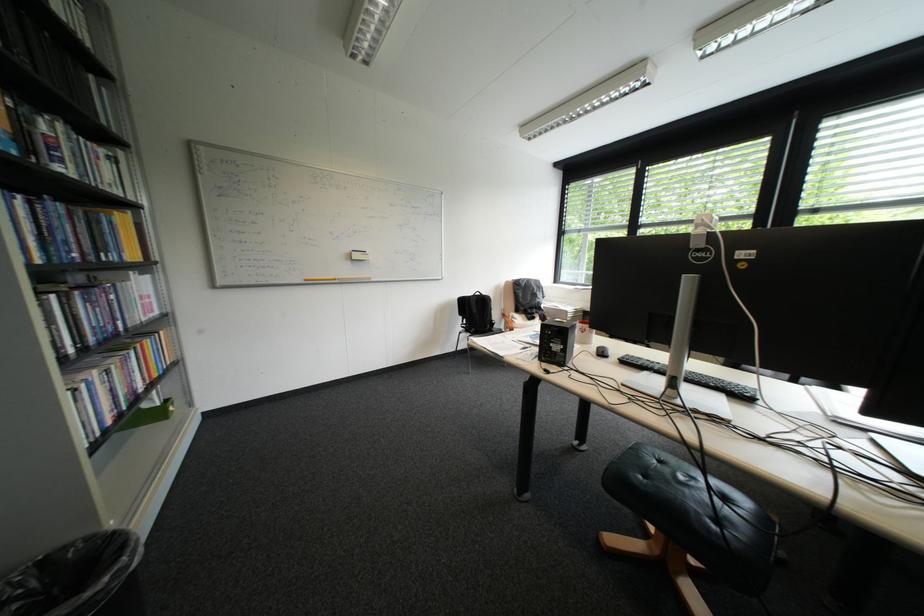
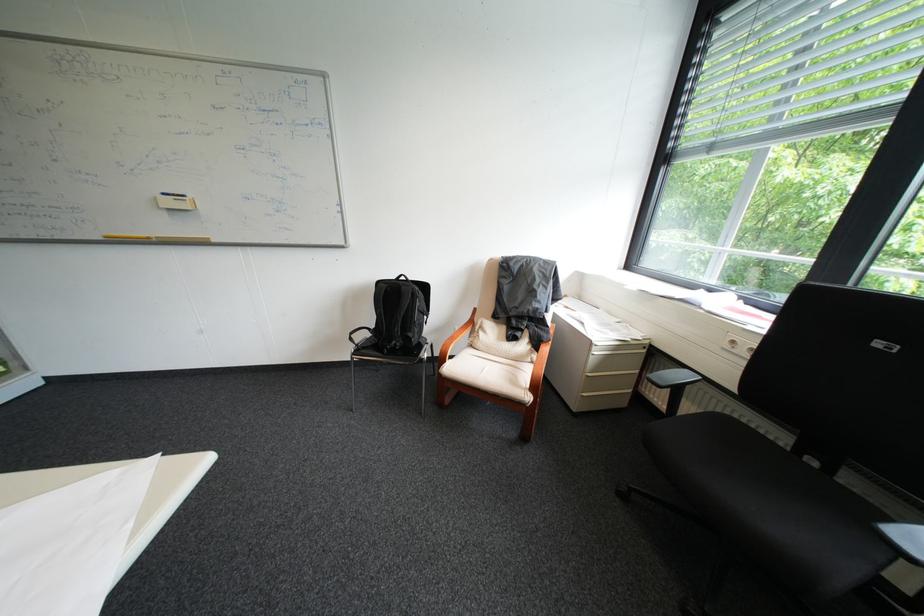
Find the pixel in the second image that matches the point at 496,297 in the first image.

(415, 288)